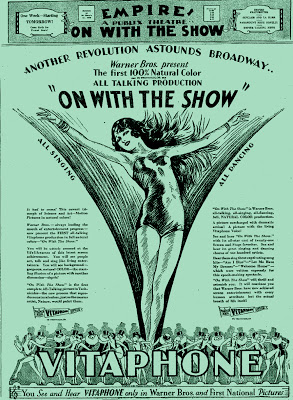
Identify the location of poster. (261, 166).